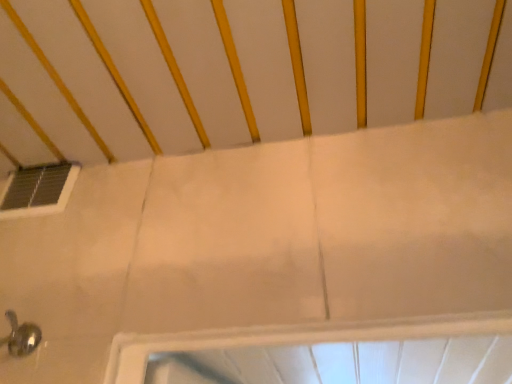
Question: Could you tell me if transparent glass window at upper left is turned towards white matte infant bed at upper center?

Choices:
 (A) yes
 (B) no

Answer: (B)

Question: From the image's perspective, is transparent glass window at upper left located beneath white matte infant bed at upper center?

Choices:
 (A) no
 (B) yes

Answer: (B)

Question: From the image's perspective, is transparent glass window at upper left above white matte infant bed at upper center?

Choices:
 (A) no
 (B) yes

Answer: (A)

Question: Is transparent glass window at upper left facing away from white matte infant bed at upper center?

Choices:
 (A) yes
 (B) no

Answer: (B)

Question: Considering the relative sizes of transparent glass window at upper left and white matte infant bed at upper center in the image provided, is transparent glass window at upper left smaller than white matte infant bed at upper center?

Choices:
 (A) no
 (B) yes

Answer: (B)

Question: Considering the relative positions of transparent glass window at upper left and white matte infant bed at upper center in the image provided, is transparent glass window at upper left to the right of white matte infant bed at upper center from the viewer's perspective?

Choices:
 (A) yes
 (B) no

Answer: (B)

Question: From the image's perspective, is white matte infant bed at upper center on transparent glass window at upper left?

Choices:
 (A) no
 (B) yes

Answer: (B)

Question: From a real-world perspective, is white matte infant bed at upper center located higher than transparent glass window at upper left?

Choices:
 (A) yes
 (B) no

Answer: (A)

Question: Is white matte infant bed at upper center oriented towards transparent glass window at upper left?

Choices:
 (A) no
 (B) yes

Answer: (A)

Question: Can you confirm if white matte infant bed at upper center is smaller than transparent glass window at upper left?

Choices:
 (A) yes
 (B) no

Answer: (B)

Question: Is white matte infant bed at upper center at the right side of transparent glass window at upper left?

Choices:
 (A) yes
 (B) no

Answer: (A)

Question: Considering the relative sizes of white matte infant bed at upper center and transparent glass window at upper left in the image provided, is white matte infant bed at upper center shorter than transparent glass window at upper left?

Choices:
 (A) yes
 (B) no

Answer: (A)

Question: Considering the positions of transparent glass window at upper left and white matte infant bed at upper center in the image, is transparent glass window at upper left wider or thinner than white matte infant bed at upper center?

Choices:
 (A) thin
 (B) wide

Answer: (A)